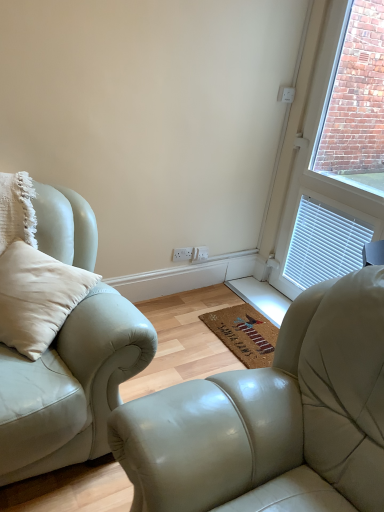
The image size is (384, 512). In order to click on empty space that is ontop of coir mat at center (from a real-world perspective) in this screenshot , I will do `click(249, 330)`.